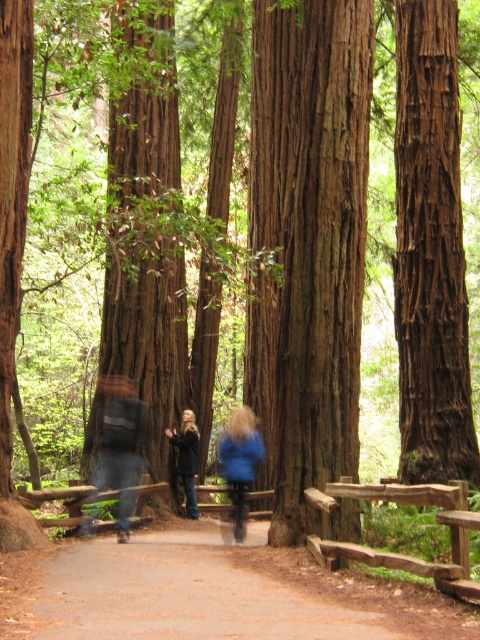
Question: Estimate the real-world distances between objects in this image. Which object is farther from the brown dirt path at center?

Choices:
 (A) blue wool coat at center
 (B) dark blue jeans at center
 (C) blue matte jacket at center

Answer: (A)

Question: Estimate the real-world distances between objects in this image. Which object is farther from the blue denim jeans at center?

Choices:
 (A) brown dirt path at center
 (B) smooth brown tree trunk at center
 (C) blue wool coat at center

Answer: (A)

Question: Is the position of blue wool coat at center more distant than that of dark blue jeans at center?

Choices:
 (A) no
 (B) yes

Answer: (B)

Question: In this image, where is smooth brown tree trunk at center located relative to blue matte jacket at center?

Choices:
 (A) right
 (B) left

Answer: (A)

Question: Can you confirm if blue matte jacket at center is wider than blue denim jeans at center?

Choices:
 (A) no
 (B) yes

Answer: (A)

Question: Among these points, which one is nearest to the camera?

Choices:
 (A) (278, 529)
 (B) (184, 440)
 (C) (398, 292)
 (D) (118, 416)

Answer: (A)